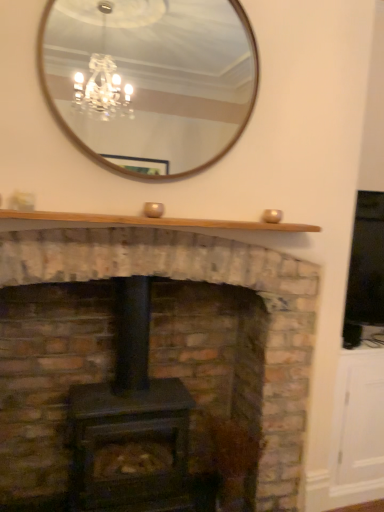
Question: Is natural wood mantle at upper center taller or shorter than wooden-framed mirror at upper center?

Choices:
 (A) short
 (B) tall

Answer: (A)

Question: Is natural wood mantle at upper center in front of or behind wooden-framed mirror at upper center in the image?

Choices:
 (A) front
 (B) behind

Answer: (A)

Question: Which of these objects is positioned closest to the wooden-framed mirror at upper center?

Choices:
 (A) natural wood mantle at upper center
 (B) matte black wood burning stove at center
 (C) brick fireplace at center

Answer: (B)

Question: Estimate the real-world distances between objects in this image. Which object is farther from the brick fireplace at center?

Choices:
 (A) natural wood mantle at upper center
 (B) matte black wood burning stove at center
 (C) wooden-framed mirror at upper center

Answer: (C)